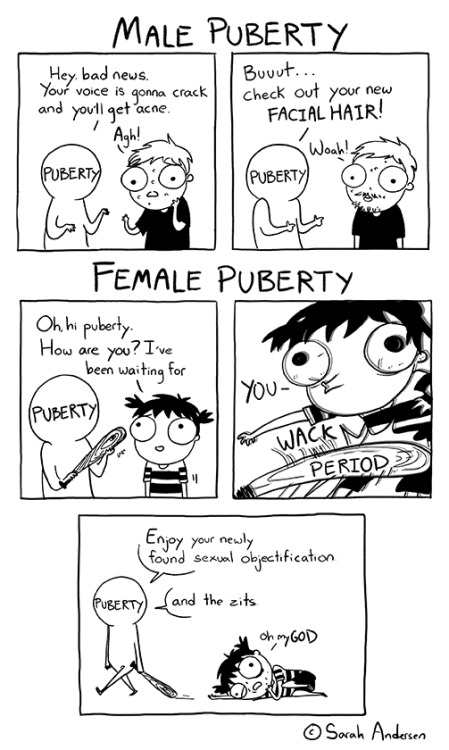
The image size is (449, 750). I want to click on panels, so (x=299, y=591), (x=199, y=361), (x=263, y=366), (x=203, y=196), (x=240, y=141).